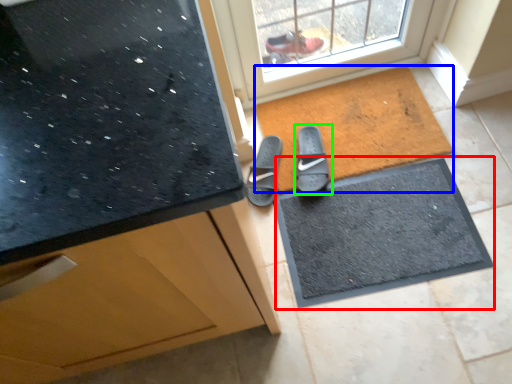
Question: Which object is positioned farthest from doormat (highlighted by a red box)? Select from mat (highlighted by a blue box) and footwear (highlighted by a green box).

Choices:
 (A) mat
 (B) footwear

Answer: (B)